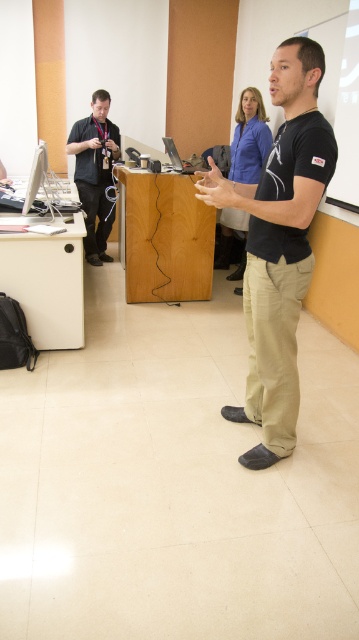
You are organizing a school event and need to know if the matte black lanyard at left can be used to hold the name tag from the black matte shirt at center. Based on their widths, is this possible?

The matte black lanyard at left might be wider than the black matte shirt at center, so it could potentially accommodate the name tag if the lanyard is wide enough to hold it comfortably.

You are attending a presentation in the classroom and need to reach the silver metallic laptop at center to take a note. However, there is a matte black lanyard at left in your way. Can you easily access the laptop without moving the lanyard?

The matte black lanyard at left is further to the viewer than the silver metallic laptop at center, meaning the lanyard is closer to you. Since the lanyard is closer, it might block your direct path to the laptop. You would need to move around it or adjust your position to access the laptop.

You are a person who is 5 feet tall and wants to walk from the black cotton shirt at center to the matte black lanyard at left. Is there enough space for you to walk through the area between them?

The distance between the black cotton shirt at center and the matte black lanyard at left is 9.27 feet, so yes, there is enough space for a 5 feet tall person to walk through the area between them.